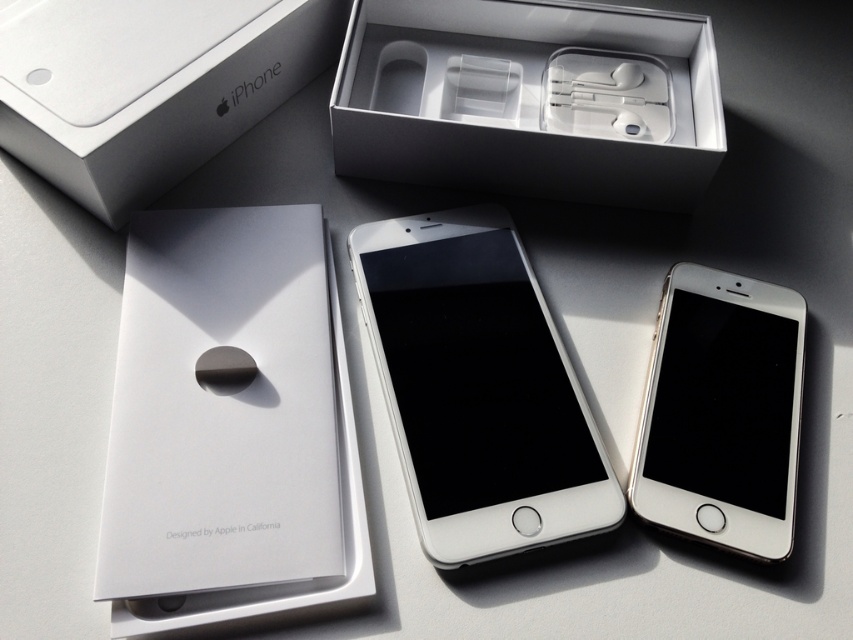
Who is positioned more to the right, white matte earphones at center or silver metallic ipod at lower right?

silver metallic ipod at lower right is more to the right.

Where is `white matte earphones at center`? white matte earphones at center is located at coordinates (531, 99).

Where is `white matte earphones at center`? The width and height of the screenshot is (853, 640). white matte earphones at center is located at coordinates (531, 99).

Which of these two, white matte earphones at center or sleek silver iphone box at upper left, stands taller?

sleek silver iphone box at upper left

Can you confirm if white matte earphones at center is positioned below sleek silver iphone box at upper left?

Yes.

This screenshot has width=853, height=640. What do you see at coordinates (531, 99) in the screenshot?
I see `white matte earphones at center` at bounding box center [531, 99].

In order to click on white matte earphones at center in this screenshot , I will do `click(531, 99)`.

Describe the element at coordinates (149, 88) in the screenshot. Image resolution: width=853 pixels, height=640 pixels. I see `sleek silver iphone box at upper left` at that location.

Is point (158, 24) closer to viewer compared to point (732, 276)?

No, (158, 24) is behind (732, 276).

Image resolution: width=853 pixels, height=640 pixels. I want to click on sleek silver iphone box at upper left, so click(x=149, y=88).